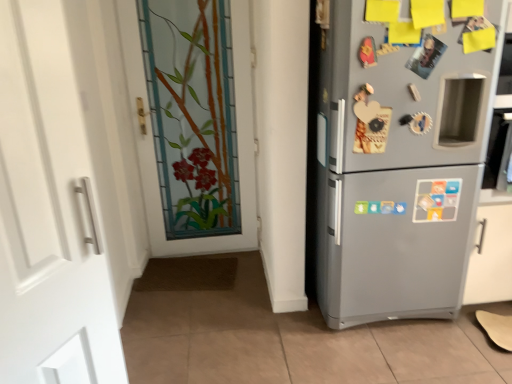
Question: Considering the relative sizes of satin silver fridge at right and stained glass door at center, acting as the 2th door starting from the front, in the image provided, is satin silver fridge at right wider than stained glass door at center, acting as the 2th door starting from the front,?

Choices:
 (A) no
 (B) yes

Answer: (B)

Question: Does satin silver fridge at right have a greater height compared to stained glass door at center, which appears as the 1th door when viewed from the back?

Choices:
 (A) no
 (B) yes

Answer: (A)

Question: Does satin silver fridge at right appear on the right side of stained glass door at center, acting as the 1th door starting from the right?

Choices:
 (A) no
 (B) yes

Answer: (B)

Question: Would you say satin silver fridge at right contains stained glass door at center, acting as the 1th door starting from the right?

Choices:
 (A) no
 (B) yes

Answer: (A)

Question: From the image's perspective, is satin silver fridge at right over stained glass door at center, acting as the 1th door starting from the right?

Choices:
 (A) yes
 (B) no

Answer: (B)

Question: Does satin silver fridge at right come behind stained glass door at center, acting as the 1th door starting from the right?

Choices:
 (A) yes
 (B) no

Answer: (B)

Question: Would you say satin silver fridge at right is a long distance from white matte door at left, the first door positioned from the front?

Choices:
 (A) yes
 (B) no

Answer: (A)

Question: Considering the relative sizes of satin silver fridge at right and white matte door at left, placed as the first door when sorted from left to right, in the image provided, is satin silver fridge at right bigger than white matte door at left, placed as the first door when sorted from left to right,?

Choices:
 (A) yes
 (B) no

Answer: (A)

Question: Is satin silver fridge at right at the left side of white matte door at left, which ranks as the 2th door in right-to-left order?

Choices:
 (A) yes
 (B) no

Answer: (B)

Question: From the image's perspective, would you say satin silver fridge at right is positioned over white matte door at left, placed as the first door when sorted from left to right?

Choices:
 (A) yes
 (B) no

Answer: (A)

Question: From a real-world perspective, is satin silver fridge at right located beneath white matte door at left, the first door positioned from the front?

Choices:
 (A) yes
 (B) no

Answer: (A)

Question: Is satin silver fridge at right not within white matte door at left, which ranks as the 2th door in right-to-left order?

Choices:
 (A) yes
 (B) no

Answer: (A)

Question: From a real-world perspective, is white matte door at left, which ranks as the 2th door in right-to-left order, located higher than satin silver fridge at right?

Choices:
 (A) yes
 (B) no

Answer: (A)